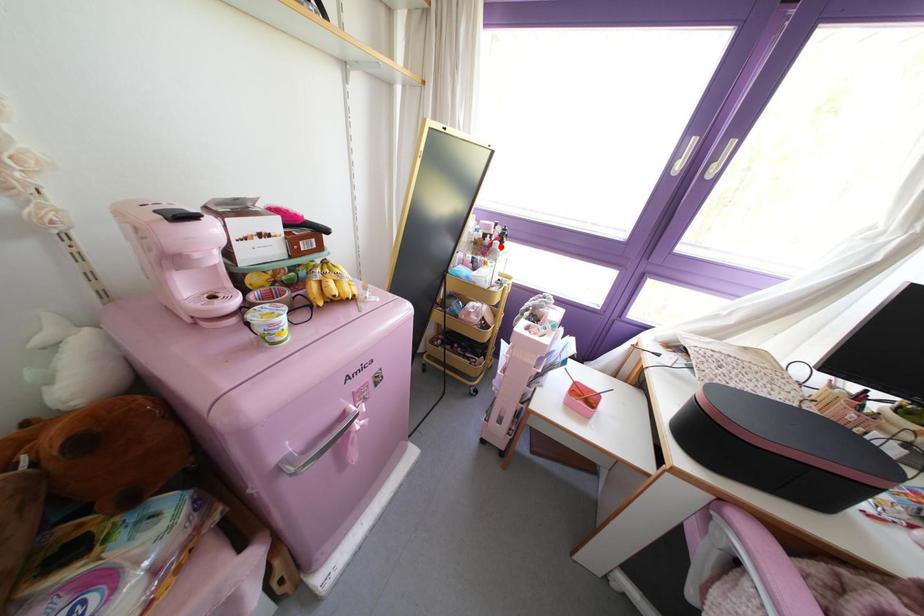
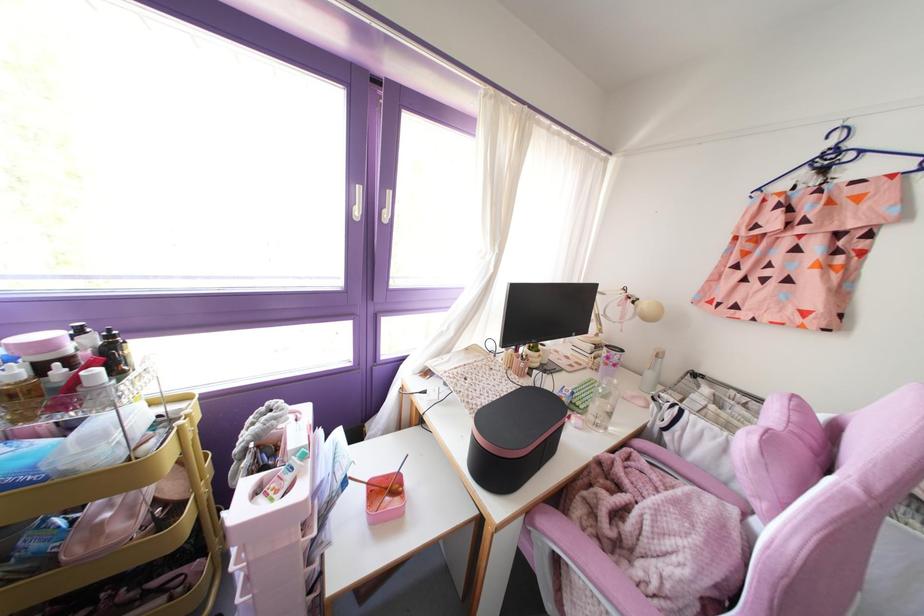
The point at the highlighted location is marked in the first image. Where is the corresponding point in the second image?

(116, 373)